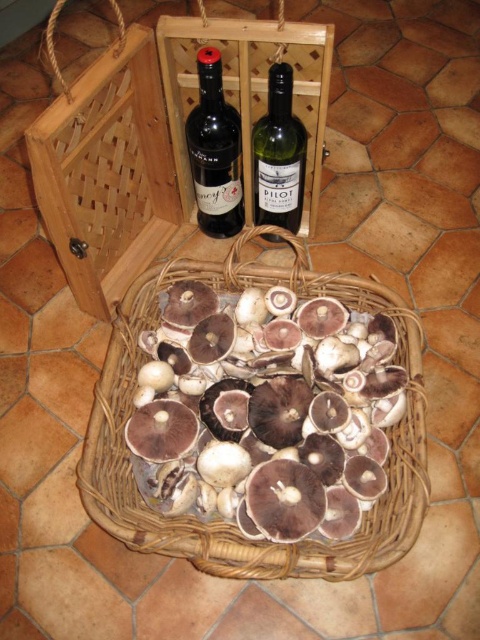
Question: Does matte glass wine bottle at upper center have a larger size compared to green glass bottle at upper center?

Choices:
 (A) yes
 (B) no

Answer: (A)

Question: Which is farther from the green glass bottle at upper center?

Choices:
 (A) woven brown basket at center
 (B) matte glass wine bottle at upper center

Answer: (A)

Question: Estimate the real-world distances between objects in this image. Which object is closer to the green glass bottle at upper center?

Choices:
 (A) woven brown basket at center
 (B) matte glass wine bottle at upper center

Answer: (B)

Question: Is woven brown basket at center further to camera compared to matte glass wine bottle at upper center?

Choices:
 (A) no
 (B) yes

Answer: (A)

Question: Which object is the farthest from the green glass bottle at upper center?

Choices:
 (A) woven brown basket at center
 (B) matte glass wine bottle at upper center

Answer: (A)

Question: Is woven brown basket at center wider than green glass bottle at upper center?

Choices:
 (A) yes
 (B) no

Answer: (A)